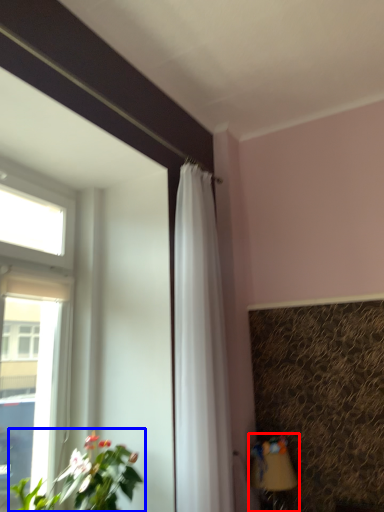
Question: Which of the following is the farthest to the observer, table lamp (highlighted by a red box) or houseplant (highlighted by a blue box)?

Choices:
 (A) table lamp
 (B) houseplant

Answer: (A)